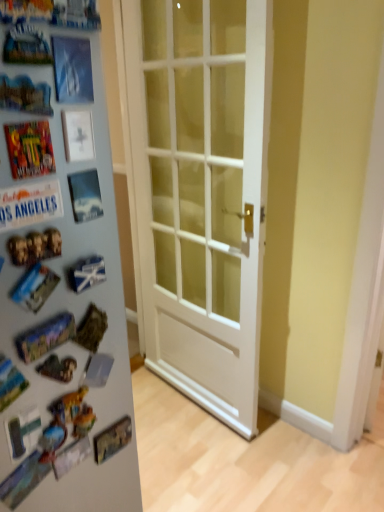
Locate an element on the screen. vacant space underneath white glossy door at center (from a real-world perspective) is located at coordinates (213, 461).